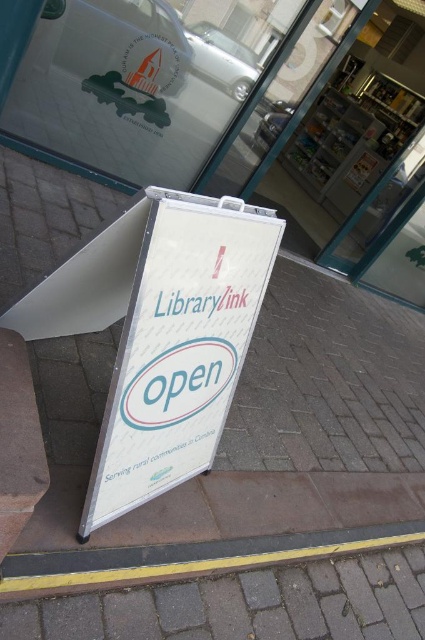
You are a delivery person trying to park your van on the street. You see a white plastic sign at center and a yellow rubber at lower center. According to traffic rules, you must not park within 3 meters of either object. Which object is closer to the van if the van is parked exactly between them?

The yellow rubber at lower center is closer to the van because it is positioned below the white plastic sign at center, so the distance from the van to the yellow rubber at lower center would be shorter than to the white plastic sign at center.

You are designing a new layout for the sidewalk and need to place both the white plastic sign at center and the yellow rubber at lower center. Which object has a smaller width and should be placed in a tighter space?

The white plastic sign at center has a smaller width than the yellow rubber at lower center, so it should be placed in a tighter space.

You are a delivery person with a box that is 18 inches long. You need to place the box between the white plastic sign at center and the yellow rubber at lower center. Is there enough space between them to fit the box?

The white plastic sign at center and yellow rubber at lower center are 17.72 inches apart from each other. Since the box is 18 inches long, it will not fit between them as the space is slightly smaller than the box.